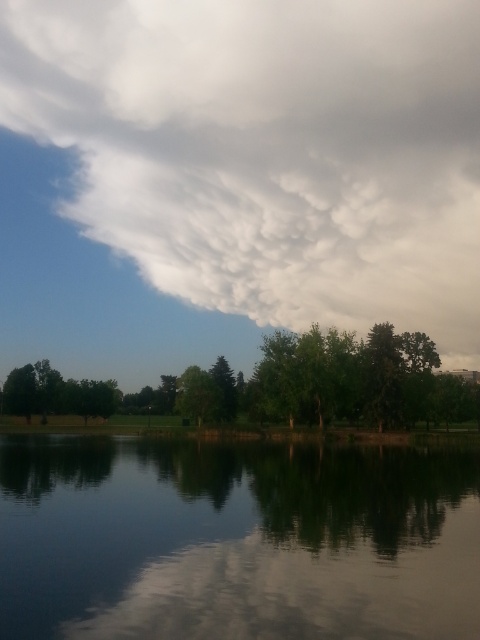
Question: Is smooth reflective water at center above green leafy tree at center?

Choices:
 (A) yes
 (B) no

Answer: (B)

Question: Which object is farther from the camera taking this photo?

Choices:
 (A) smooth reflective water at center
 (B) white fluffy cloud at upper center
 (C) green leafy tree at center

Answer: (B)

Question: Which object appears farthest from the camera in this image?

Choices:
 (A) smooth reflective water at center
 (B) white fluffy cloud at upper center

Answer: (B)

Question: Among these points, which one is nearest to the camera?

Choices:
 (A) (368, 417)
 (B) (408, 266)
 (C) (87, 580)

Answer: (C)

Question: Does smooth reflective water at center lie in front of green leafy tree at center?

Choices:
 (A) yes
 (B) no

Answer: (A)

Question: Does white fluffy cloud at upper center appear on the right side of smooth reflective water at center?

Choices:
 (A) yes
 (B) no

Answer: (B)